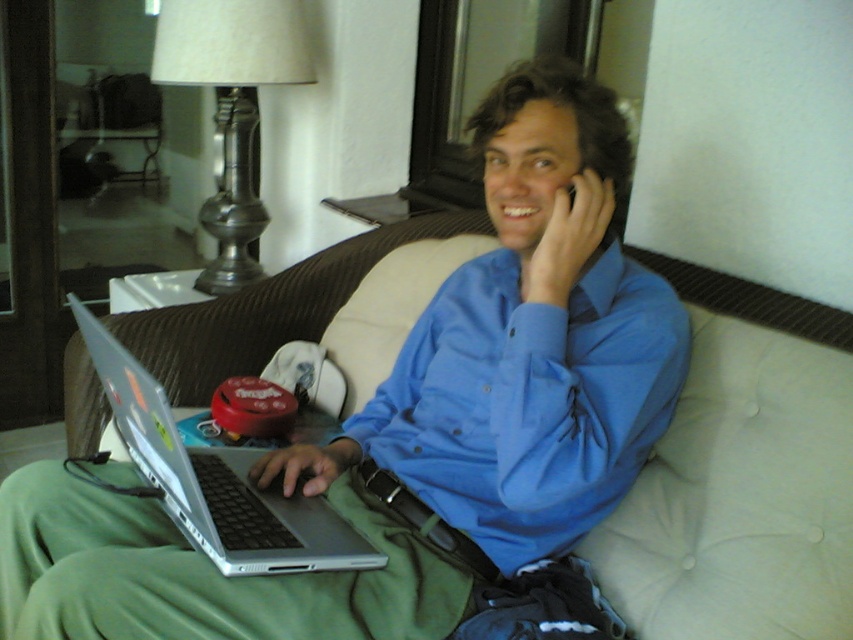
Who is higher up, blue smooth shirt at center or silver metallic laptop at center?

blue smooth shirt at center

Is blue smooth shirt at center taller than silver metallic laptop at center?

Correct, blue smooth shirt at center is much taller as silver metallic laptop at center.

Is point (598, 332) positioned behind point (199, 467)?

No, it is in front of (199, 467).

Find the location of a particular element. blue smooth shirt at center is located at coordinates (521, 396).

You are a GUI agent. You are given a task and a screenshot of the screen. Output one action in this format:
    pyautogui.click(x=<x>, y=<y>)
    Task: Click on the matte silver laptop at center
    The height and width of the screenshot is (640, 853).
    Given the screenshot: What is the action you would take?
    pos(416,419)

Does matte silver laptop at center appear on the left side of silver metallic laptop at center?

No, matte silver laptop at center is not to the left of silver metallic laptop at center.

Describe the element at coordinates (416, 419) in the screenshot. The width and height of the screenshot is (853, 640). I see `matte silver laptop at center` at that location.

At what (x,y) coordinates should I click in order to perform the action: click on matte silver laptop at center. Please return your answer as a coordinate pair (x, y). Image resolution: width=853 pixels, height=640 pixels. Looking at the image, I should click on (416, 419).

This screenshot has width=853, height=640. Describe the element at coordinates (416, 419) in the screenshot. I see `matte silver laptop at center` at that location.

Can you confirm if matte silver laptop at center is wider than blue smooth shirt at center?

Yes.

Who is more distant from viewer, (404, 456) or (595, 465)?

Positioned behind is point (404, 456).

At what (x,y) coordinates should I click in order to perform the action: click on matte silver laptop at center. Please return your answer as a coordinate pair (x, y). Looking at the image, I should click on (416, 419).